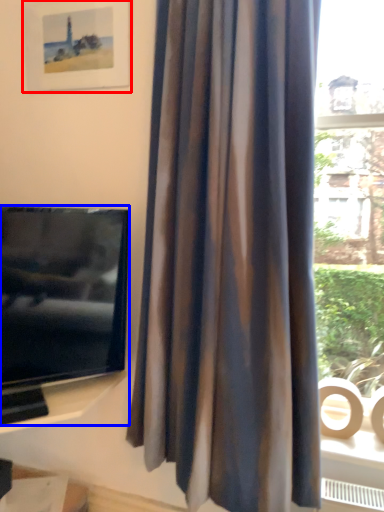
Question: Which object appears closest to the camera in this image, picture frame (highlighted by a red box) or television (highlighted by a blue box)?

Choices:
 (A) picture frame
 (B) television

Answer: (B)